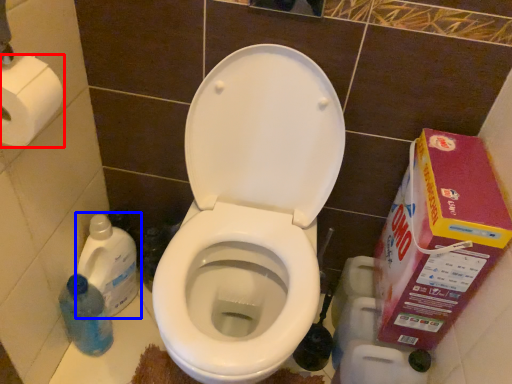
Question: Which of the following is the closest to the observer, toilet paper (highlighted by a red box) or cleaning product (highlighted by a blue box)?

Choices:
 (A) toilet paper
 (B) cleaning product

Answer: (A)